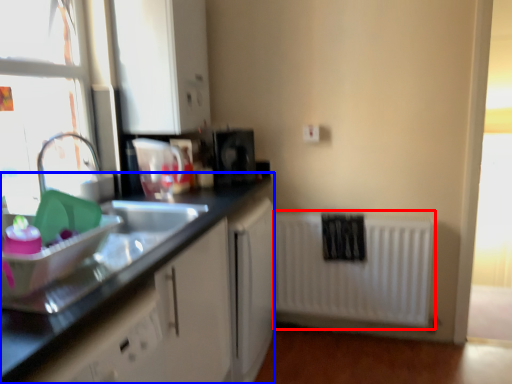
Question: Which object is further to the camera taking this photo, radiator (highlighted by a red box) or countertop (highlighted by a blue box)?

Choices:
 (A) radiator
 (B) countertop

Answer: (A)